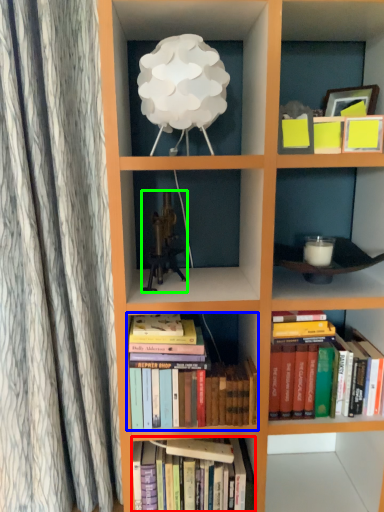
Question: Estimate the real-world distances between objects in this image. Which object is closer to book (highlighted by a red box), book (highlighted by a blue box) or toy (highlighted by a green box)?

Choices:
 (A) book
 (B) toy

Answer: (A)